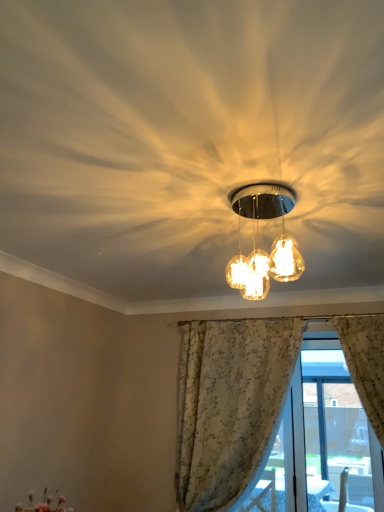
Question: Is matte glass globe at center facing towards white floral curtain at lower right?

Choices:
 (A) no
 (B) yes

Answer: (A)

Question: Is white floral curtain at lower right completely or partially inside matte glass globe at center?

Choices:
 (A) yes
 (B) no

Answer: (B)

Question: Is white floral curtain at lower right at the back of matte glass globe at center?

Choices:
 (A) no
 (B) yes

Answer: (B)

Question: Is matte glass globe at center taller than white floral curtain at lower right?

Choices:
 (A) yes
 (B) no

Answer: (B)

Question: From a real-world perspective, is matte glass globe at center on top of white floral curtain at lower right?

Choices:
 (A) yes
 (B) no

Answer: (A)

Question: Considering the positions of white lace curtain at center and matte glass globe at center in the image, is white lace curtain at center wider or thinner than matte glass globe at center?

Choices:
 (A) thin
 (B) wide

Answer: (B)

Question: From a real-world perspective, is white lace curtain at center positioned above or below matte glass globe at center?

Choices:
 (A) above
 (B) below

Answer: (B)

Question: Is white lace curtain at center inside or outside of matte glass globe at center?

Choices:
 (A) outside
 (B) inside

Answer: (A)

Question: From the image's perspective, is white lace curtain at center located above or below matte glass globe at center?

Choices:
 (A) above
 (B) below

Answer: (B)

Question: Is white lace curtain at center to the left or to the right of white floral curtain at lower right in the image?

Choices:
 (A) left
 (B) right

Answer: (A)

Question: Choose the correct answer: Is white lace curtain at center inside white floral curtain at lower right or outside it?

Choices:
 (A) inside
 (B) outside

Answer: (B)

Question: From the image's perspective, is white lace curtain at center located above or below white floral curtain at lower right?

Choices:
 (A) below
 (B) above

Answer: (B)

Question: From their relative heights in the image, would you say white lace curtain at center is taller or shorter than white floral curtain at lower right?

Choices:
 (A) tall
 (B) short

Answer: (A)

Question: From a real-world perspective, relative to matte glass globe at center, is white floral curtain at lower right vertically above or below?

Choices:
 (A) above
 (B) below

Answer: (B)

Question: Is white floral curtain at lower right situated inside matte glass globe at center or outside?

Choices:
 (A) outside
 (B) inside

Answer: (A)